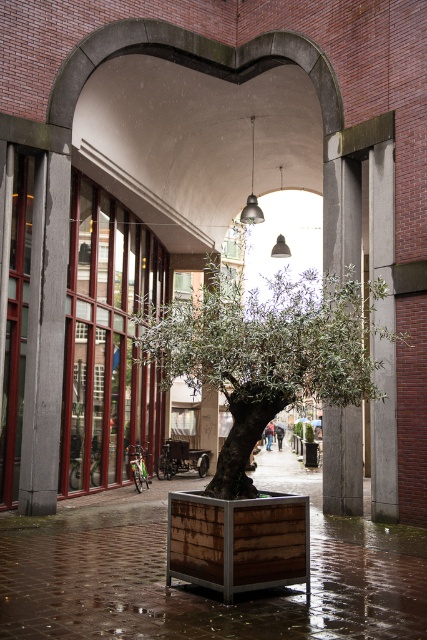
Which of these two, green leafy tree at center or wooden planter at center, stands shorter?

Standing shorter between the two is wooden planter at center.

Between green leafy tree at center and wooden planter at center, which one is positioned lower?

Positioned lower is wooden planter at center.

Who is more distant from viewer, (245,401) or (257,576)?

The point (245,401) is behind.

The width and height of the screenshot is (427, 640). Identify the location of green leafy tree at center. 268,352.